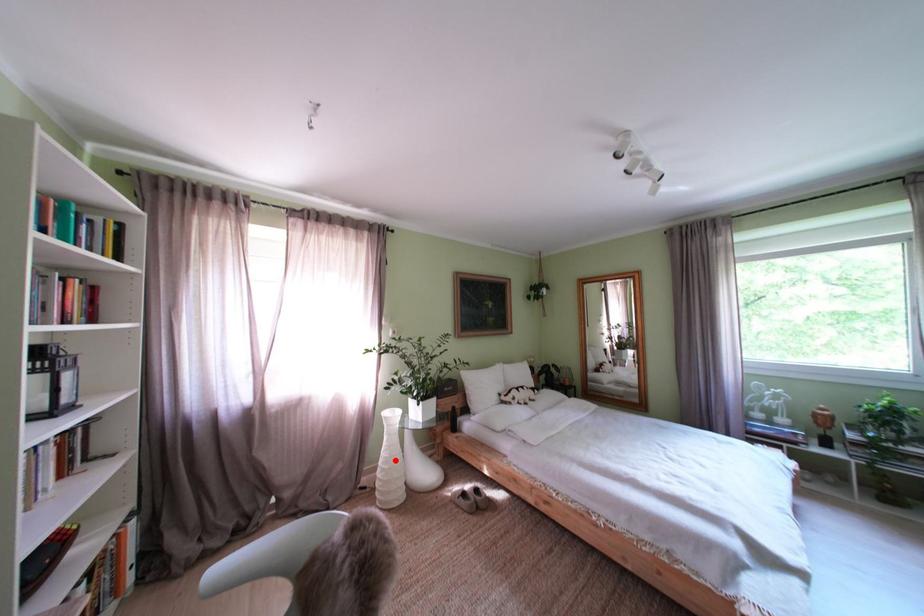
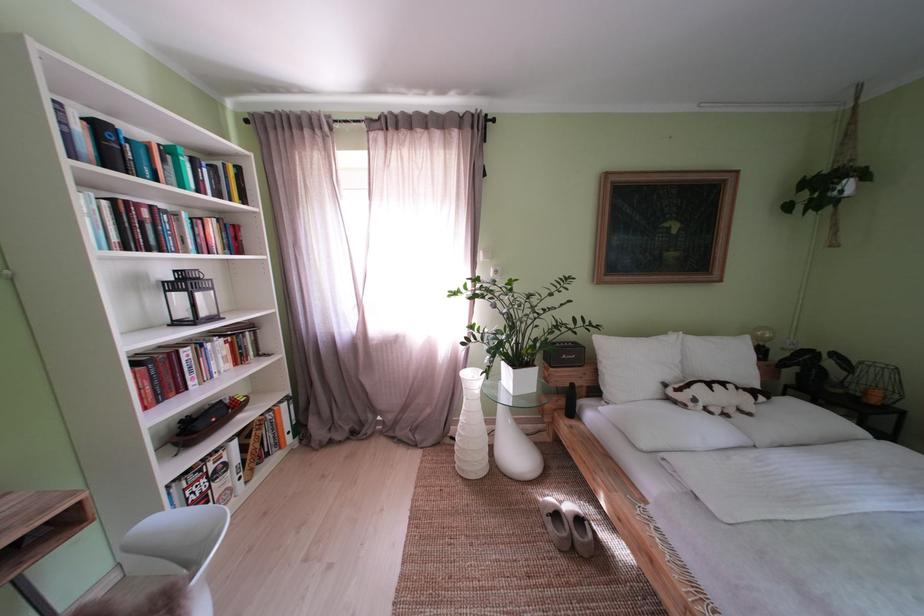
Question: I am providing you with two images of the same scene from different viewpoints. Given a red point in image1, look at the same physical point in image2. Is it:

Choices:
 (A) Closer to the viewpoint
 (B) Farther from the viewpoint

Answer: (B)